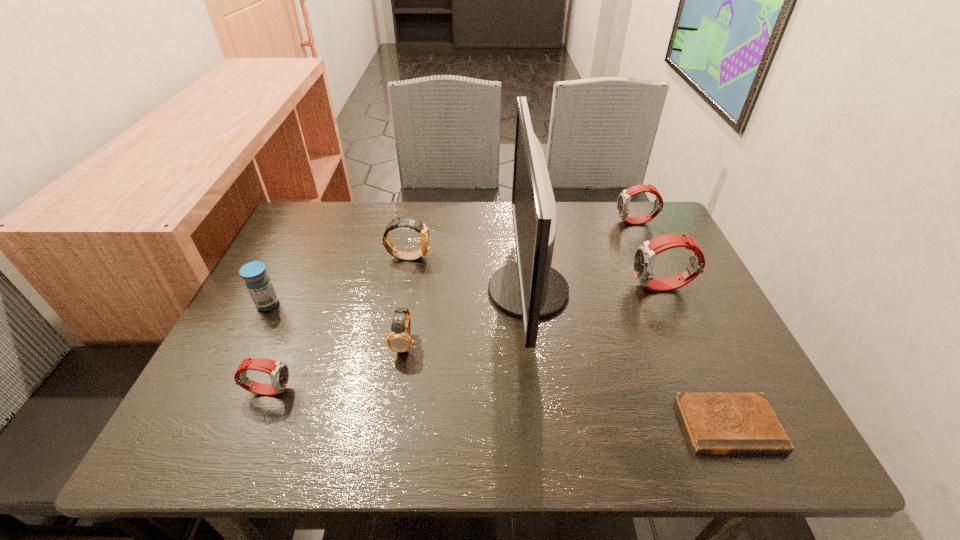
I want to click on the nearer gold watch, so click(x=399, y=340).

Where is `the second nearest watch`? the second nearest watch is located at coordinates (399, 340).

At what (x,y) coordinates should I click in order to perform the action: click on the leftmost watch. Please return your answer as a coordinate pair (x, y). Looking at the image, I should click on (278, 371).

Locate an element on the screen. the second object from left to right is located at coordinates (278, 371).

Image resolution: width=960 pixels, height=540 pixels. Identify the location of diary. (717, 423).

Find the location of a particular element. brown diary is located at coordinates (717, 423).

Find the location of a particular element. This screenshot has width=960, height=540. free space located 0.330m on the screen side of the tallest object is located at coordinates (356, 291).

Identify the location of vacant space situated 0.220m on the screen side of the tallest object. (400, 291).

Locate an element on the screen. free region located 0.340m on the screen side of the tallest object is located at coordinates (352, 291).

The image size is (960, 540). I want to click on vacant space located 0.210m on the face of the second farthest red watch, so click(549, 287).